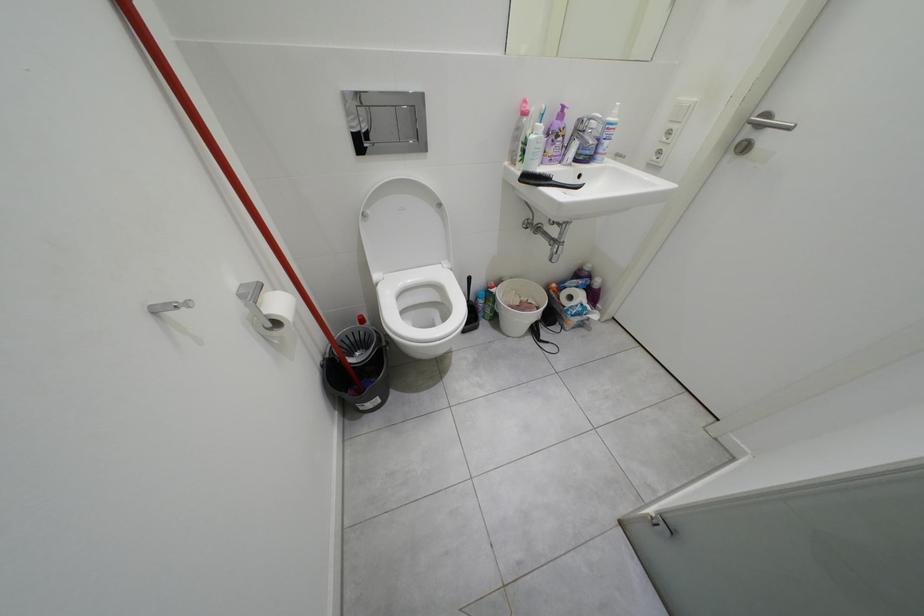
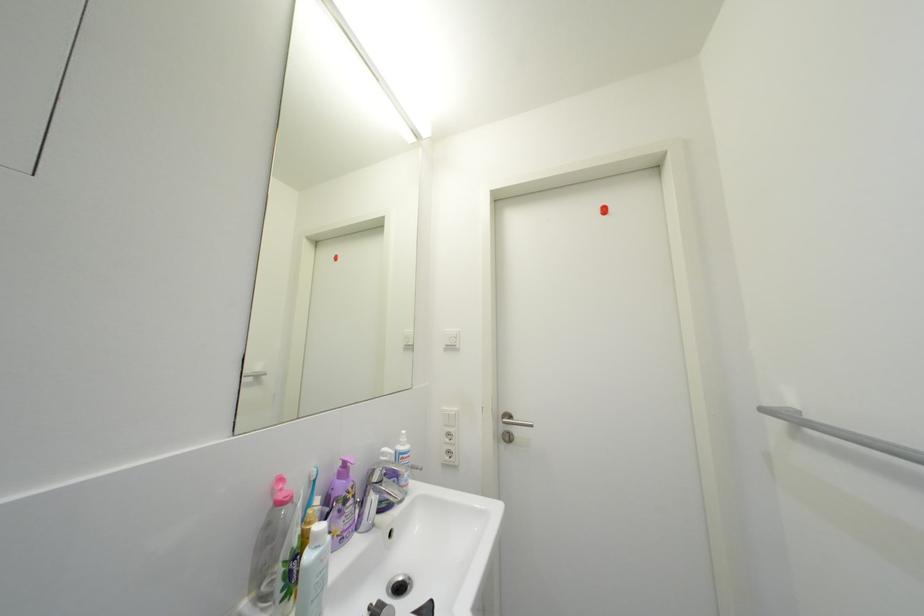
Based on the continuous images, in which direction is the camera rotating?

The rotation direction of the camera is right-up.